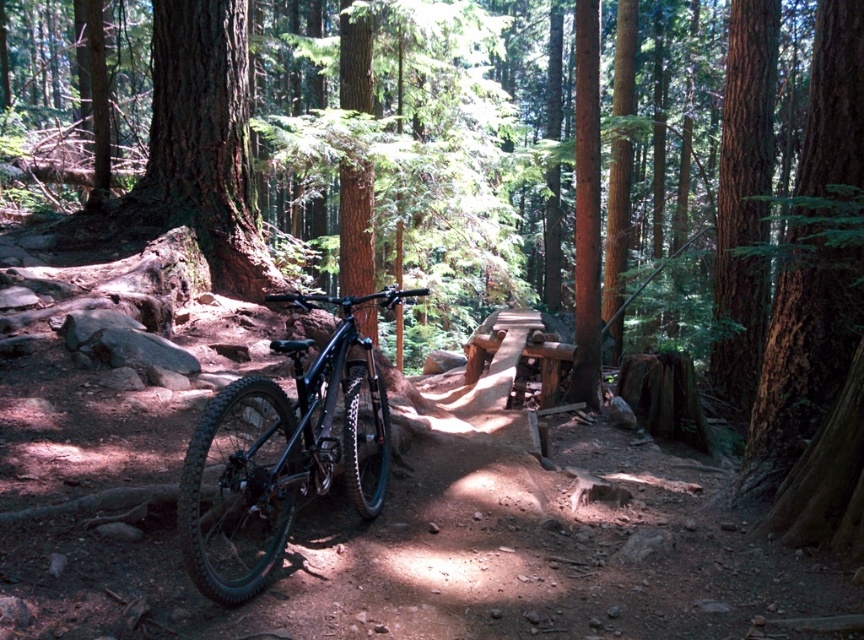
Is the position of shiny black mountain bike at center less distant than that of smooth brown bark at right?

Yes, it is.

Which is in front, point (245, 420) or point (785, 342)?

Point (245, 420) is in front.

Which is behind, point (249, 593) or point (853, 10)?

The point (853, 10) is behind.

In order to click on shiny black mountain bike at center in this screenshot , I will do `click(283, 452)`.